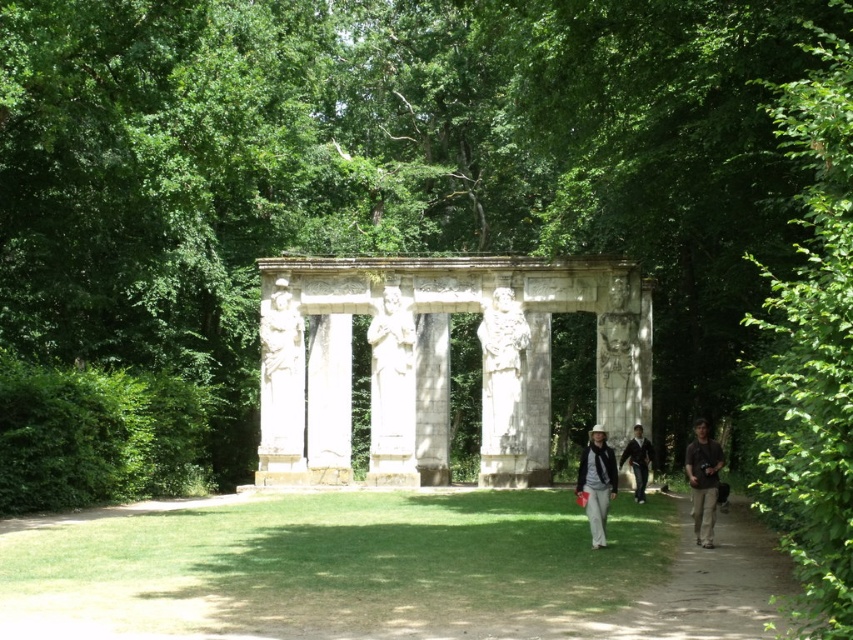
Question: Considering the real-world distances, which object is farthest from the matte black jacket at lower right?

Choices:
 (A) white stone gazebo at center
 (B) green leafy tree at right

Answer: (A)

Question: Does green leafy tree at right appear over matte black jacket at lower right?

Choices:
 (A) no
 (B) yes

Answer: (B)

Question: Can you confirm if white stone gazebo at center is thinner than matte black jacket at center?

Choices:
 (A) no
 (B) yes

Answer: (A)

Question: Which point is closer to the camera taking this photo?

Choices:
 (A) 840,540
 (B) 289,272
 (C) 637,449

Answer: (A)

Question: Among these objects, which one is nearest to the camera?

Choices:
 (A) matte black jacket at center
 (B) green leafy tree at right
 (C) dark blue jeans at center

Answer: (B)

Question: In this image, where is matte black jacket at lower right located relative to matte black jacket at center?

Choices:
 (A) left
 (B) right

Answer: (B)